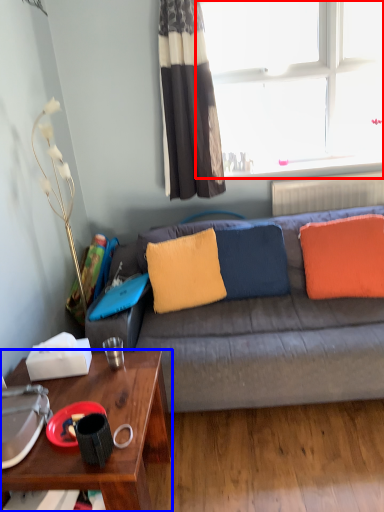
Question: Which object appears farthest to the camera in this image, window (highlighted by a red box) or desk (highlighted by a blue box)?

Choices:
 (A) window
 (B) desk

Answer: (A)